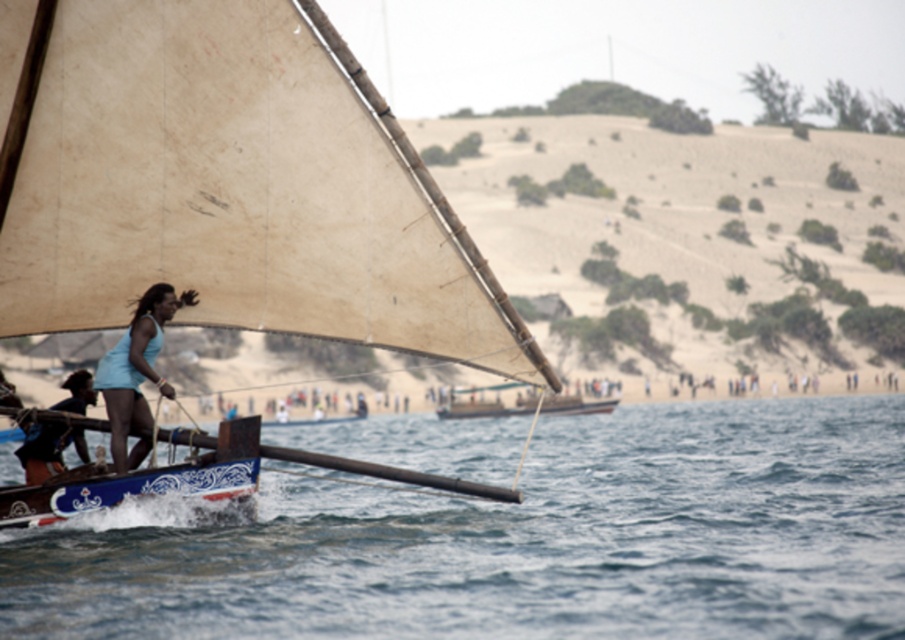
Based on the photo, between beige canvas sailboat at left and blue painted wood boat at lower left, which one is positioned higher?

beige canvas sailboat at left

Who is shorter, beige canvas sailboat at left or blue painted wood boat at lower left?

Standing shorter between the two is blue painted wood boat at lower left.

Where is `beige canvas sailboat at left`? This screenshot has width=905, height=640. beige canvas sailboat at left is located at coordinates (227, 184).

At what (x,y) coordinates should I click in order to perform the action: click on beige canvas sailboat at left. Please return your answer as a coordinate pair (x, y). Looking at the image, I should click on tap(227, 184).

Does blue water at lower left have a greater height compared to light blue fabric at center?

Incorrect, blue water at lower left's height is not larger of light blue fabric at center's.

Is point (92, 564) farther from viewer compared to point (105, 385)?

No, (92, 564) is closer to viewer.

Who is more forward, (715, 520) or (148, 433)?

Point (148, 433)

Find the location of a particular element. blue water at lower left is located at coordinates (517, 541).

Can you confirm if blue water at lower left is positioned above beige canvas sailboat at left?

No, blue water at lower left is not above beige canvas sailboat at left.

Can you confirm if blue water at lower left is positioned below beige canvas sailboat at left?

Yes, blue water at lower left is below beige canvas sailboat at left.

Is point (446, 506) positioned behind point (71, 124)?

Yes.

Image resolution: width=905 pixels, height=640 pixels. Find the location of `blue water at lower left`. blue water at lower left is located at coordinates (517, 541).